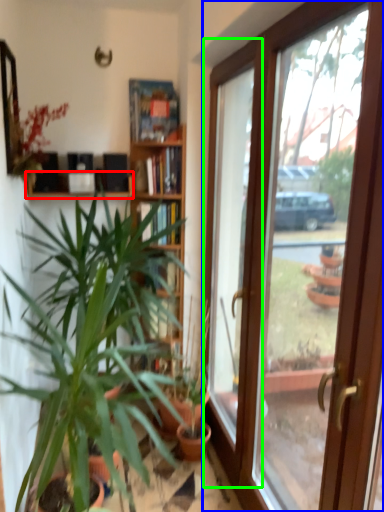
Question: Which is nearer to the shelf (highlighted by a red box)? door (highlighted by a blue box) or window (highlighted by a green box).

Choices:
 (A) door
 (B) window

Answer: (B)